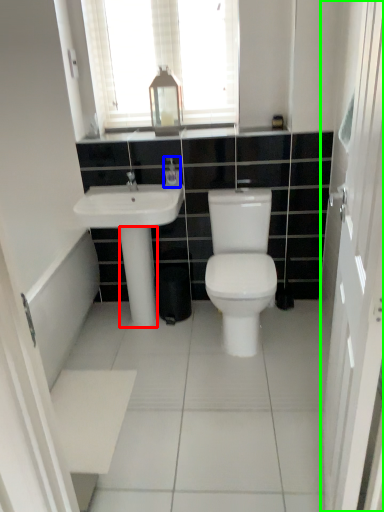
Question: Which object is the farthest from pillar (highlighted by a red box)? Choose among these: toiletry (highlighted by a blue box) or screen door (highlighted by a green box).

Choices:
 (A) toiletry
 (B) screen door

Answer: (B)